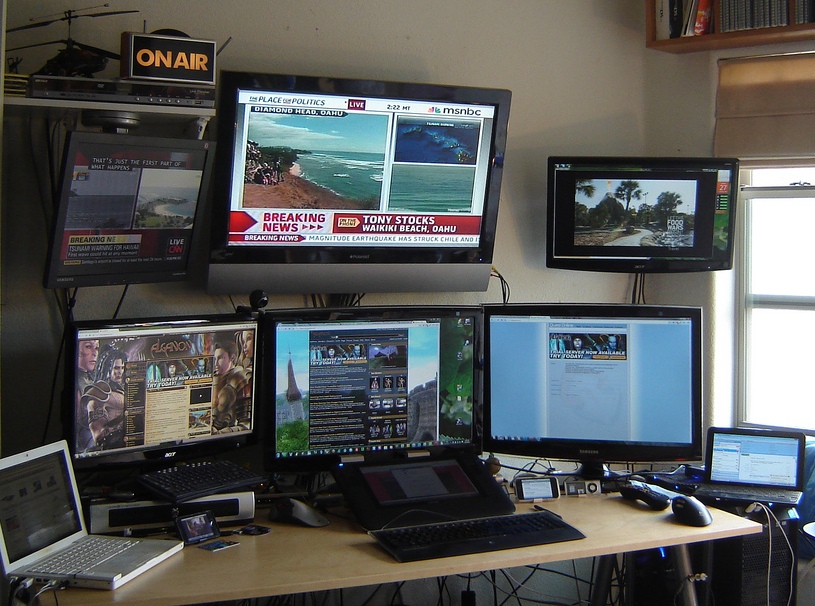
I want to click on right bottom corner of desk, so click(756, 525).